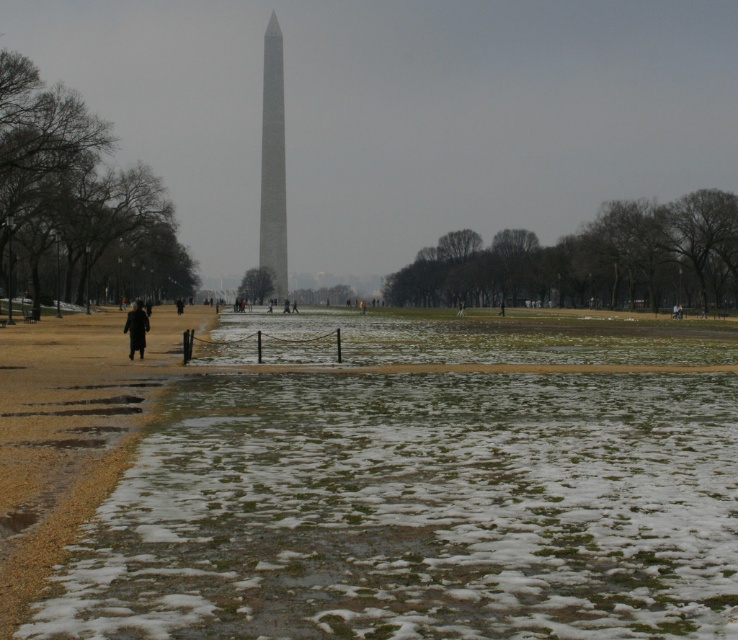
You are standing at the entrance of the park and see the smooth gray obelisk at center and the black coat at center. Which object is closer to you?

The smooth gray obelisk at center is closer to you because the black coat at center is behind it.

You are standing at point (137, 316) and want to walk towards the Washington Monument in the background. Is point (275, 44) located behind you or in front of you relative to your direction of travel?

Point (275, 44) is behind point (137, 316), so if you are facing towards the Washington Monument, point (275, 44) would be behind you relative to your direction of travel.